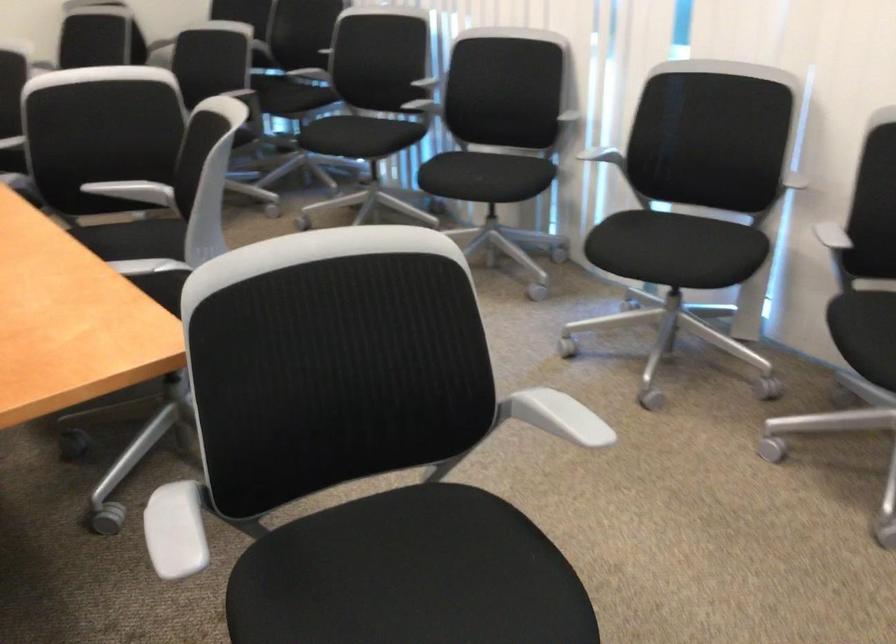
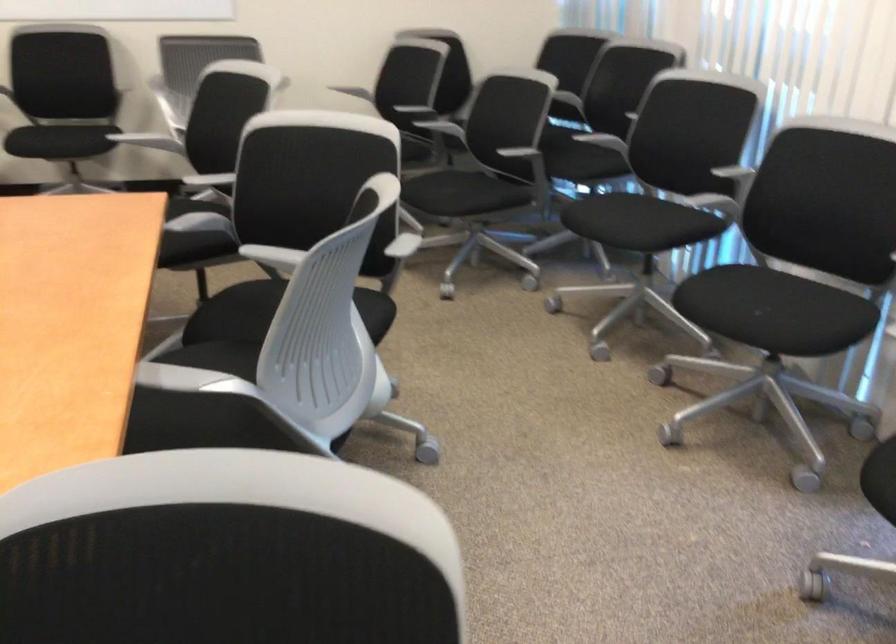
Locate, in the second image, the point that corresponds to (x=124, y=192) in the first image.

(273, 258)